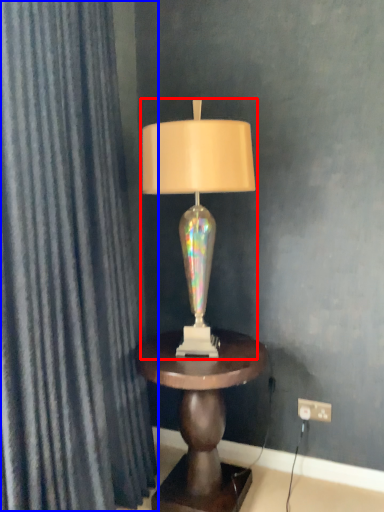
Question: Which object appears farthest to the camera in this image, lamp (highlighted by a red box) or curtain (highlighted by a blue box)?

Choices:
 (A) lamp
 (B) curtain

Answer: (A)